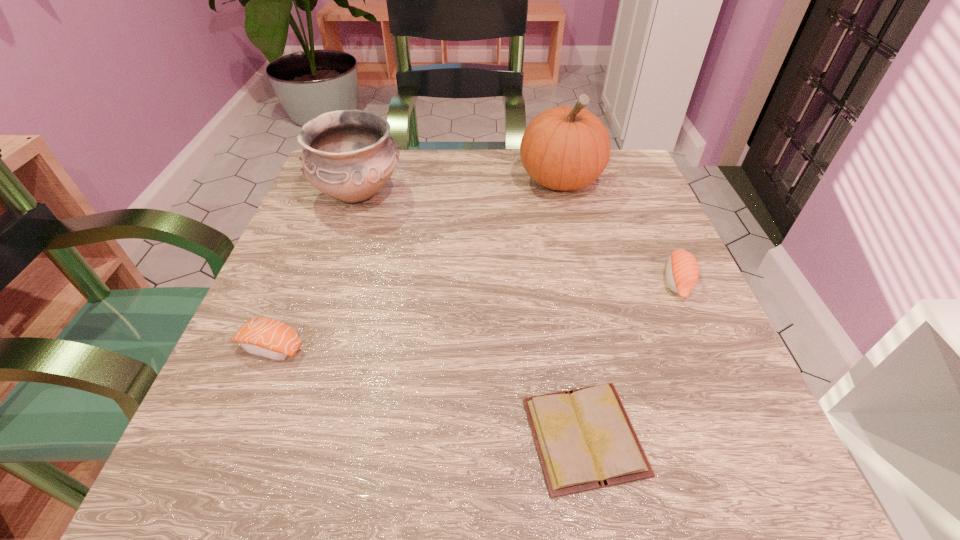
Identify the location of diary positioned at the right edge. The width and height of the screenshot is (960, 540). (584, 438).

This screenshot has height=540, width=960. What are the coordinates of `object that is positioned at the far left corner` in the screenshot? It's located at (348, 155).

What are the coordinates of `object that is at the far right corner` in the screenshot? It's located at (564, 148).

Locate an element on the screen. The height and width of the screenshot is (540, 960). object that is at the near right corner is located at coordinates (584, 438).

Image resolution: width=960 pixels, height=540 pixels. In the image, there is a desktop. What are the coordinates of `vacant area at the far edge` in the screenshot? It's located at (479, 194).

Find the location of a particular element. The width and height of the screenshot is (960, 540). blank space at the left edge of the desktop is located at coordinates (275, 275).

I want to click on vacant region at the right edge of the desktop, so click(x=695, y=355).

In the image, there is a desktop. Identify the location of vacant space at the far left corner. (368, 202).

The width and height of the screenshot is (960, 540). Find the location of `vacant area at the near left corner`. vacant area at the near left corner is located at coordinates (293, 441).

Where is `free region at the far right corner`? The image size is (960, 540). free region at the far right corner is located at coordinates (644, 198).